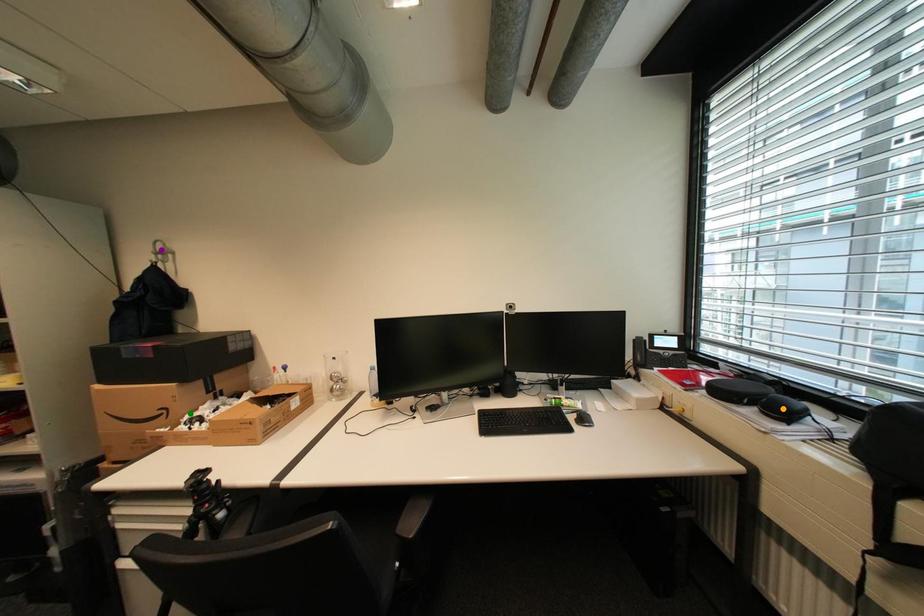
Order these from nearest to farthest:
- purple point
- orange point
- green point

orange point < green point < purple point